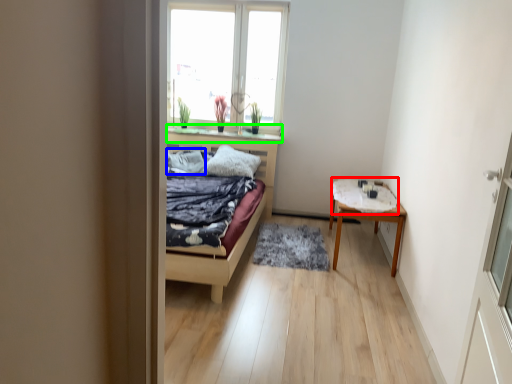
Question: Which object is the closest to the sheet (highlighted by a red box)? Choose among these: pillow (highlighted by a blue box) or window sill (highlighted by a green box).

Choices:
 (A) pillow
 (B) window sill

Answer: (B)